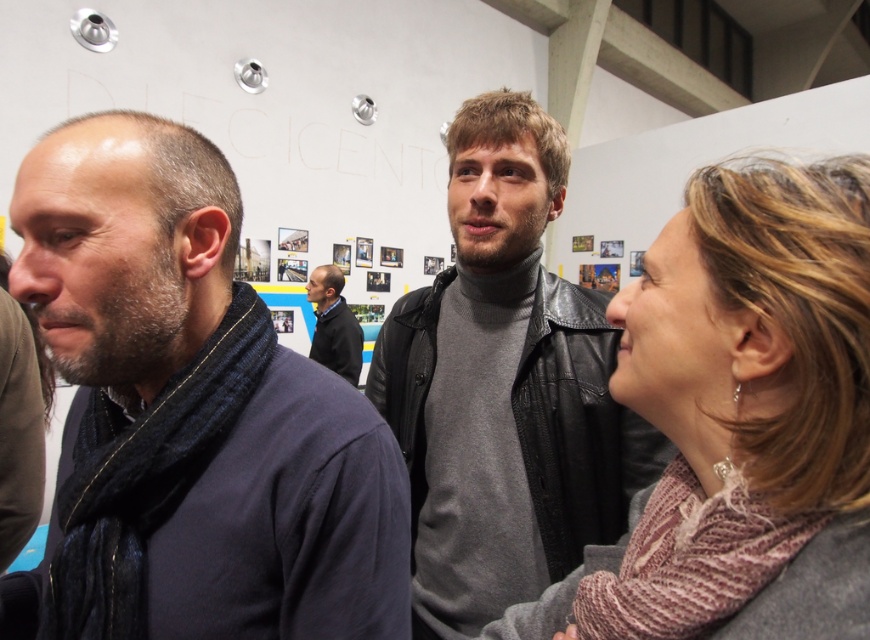
Consider the image. You are an event planner arranging seating for a panel discussion. You need to seat the person wearing the knitted pink sweater at center and the person wearing the leather jacket at center. Which piece of clothing belongs to the person with a smaller size?

The knitted pink sweater at center is smaller than the leather jacket at center, so the knitted pink sweater at center belongs to the person with a smaller size.

Based on the scene description, can you determine if the leather jacket at center is wider than the dark gray sweater at center?

The leather jacket at center might be wider than dark gray sweater at center according to the objects description.

You are standing in the gallery and want to take a photo of the person wearing the knitted pink sweater at center without including the leather jacket at center in the background. Is this possible based on their positions?

Yes, since the knitted pink sweater at center is in front of the leather jacket at center, you can position yourself to capture the knitted pink sweater at center while blocking the leather jacket at center from the view.